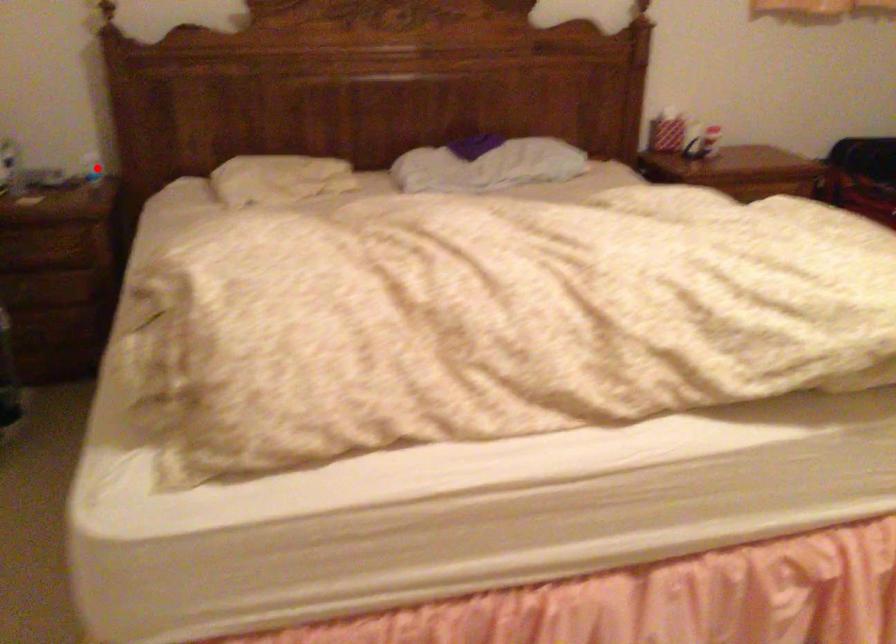
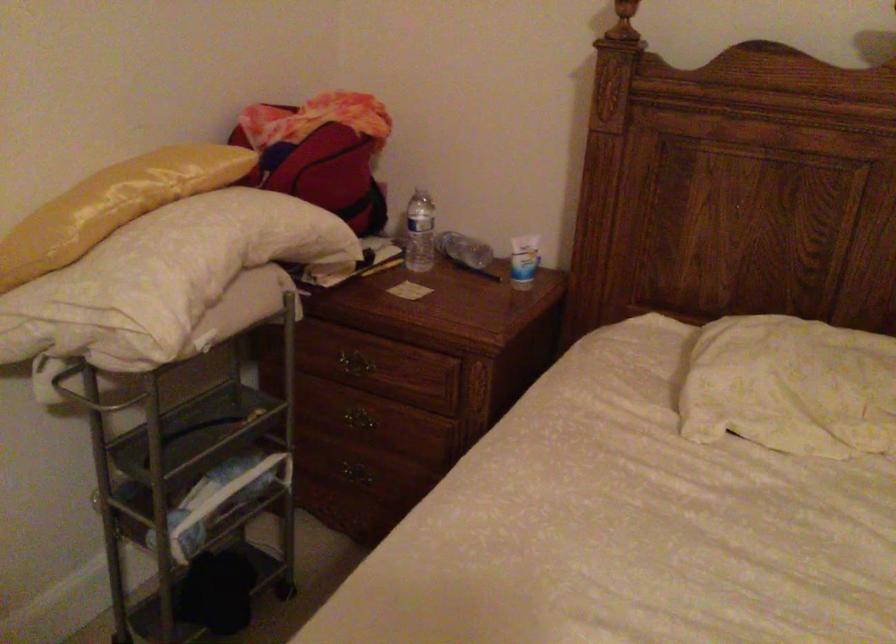
The point at the highlighted location is marked in the first image. Where is the corresponding point in the second image?

(523, 261)